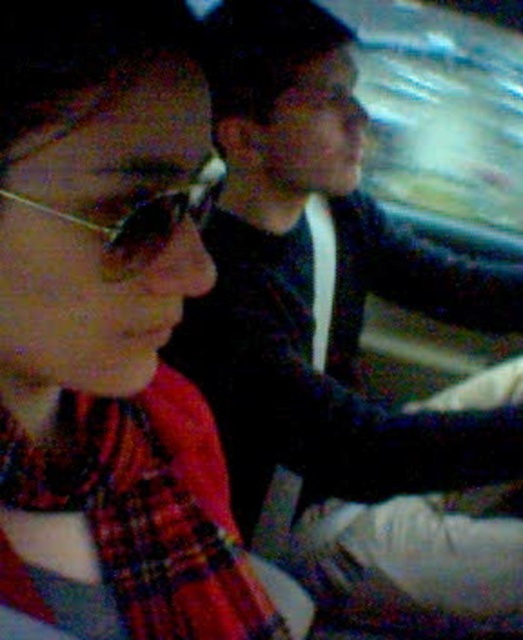
Which is more to the left, black matte shirt at center or metallic reflective glasses at upper left?

Positioned to the left is metallic reflective glasses at upper left.

Where is `black matte shirt at center`? black matte shirt at center is located at coordinates (343, 349).

Locate an element on the screen. This screenshot has width=523, height=640. black matte shirt at center is located at coordinates (343, 349).

Does plaid fabric scarf at left come in front of black matte shirt at center?

Yes, it is in front of black matte shirt at center.

Looking at this image, between plaid fabric scarf at left and black matte shirt at center, which one has more height?

Standing taller between the two is black matte shirt at center.

Between point (19, 408) and point (242, 403), which one is positioned in front?

Positioned in front is point (19, 408).

This screenshot has width=523, height=640. Find the location of `plaid fabric scarf at left`. plaid fabric scarf at left is located at coordinates (110, 339).

Does point (51, 161) come closer to viewer compared to point (120, 221)?

Yes.

Which is behind, point (119, 170) or point (85, 225)?

Positioned behind is point (85, 225).

I want to click on plaid fabric scarf at left, so click(x=110, y=339).